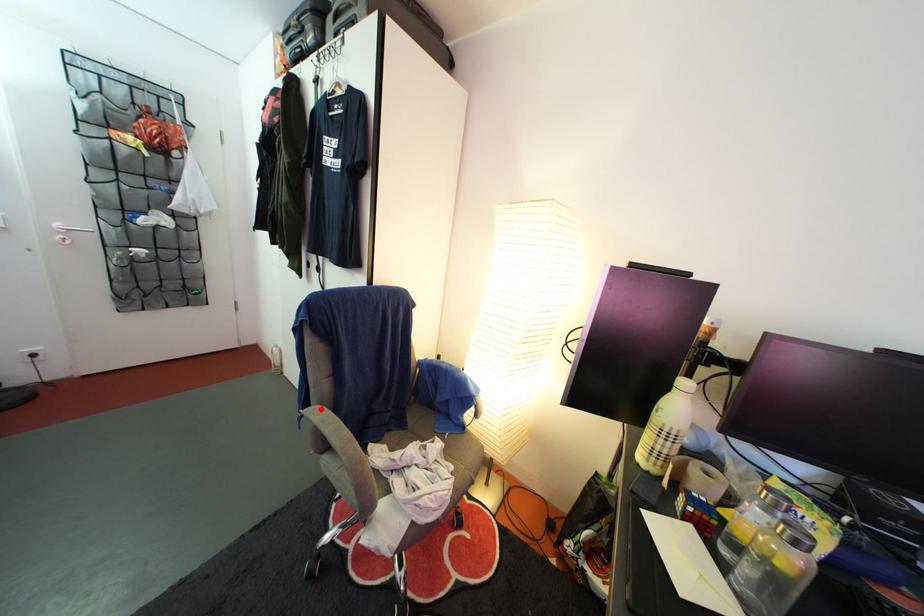
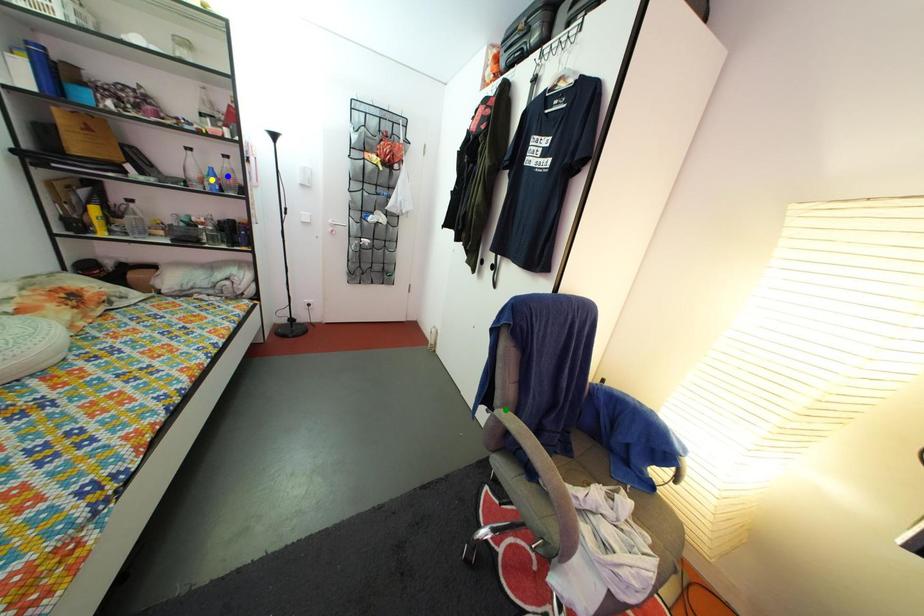
Question: I am providing you with two images of the same scene from different viewpoints. A red point is marked on the first image. You are given multiple points on the second image. In image 2, which mark is for the same physical point as the one in image 1?

Choices:
 (A) yellow point
 (B) green point
 (C) blue point

Answer: (B)